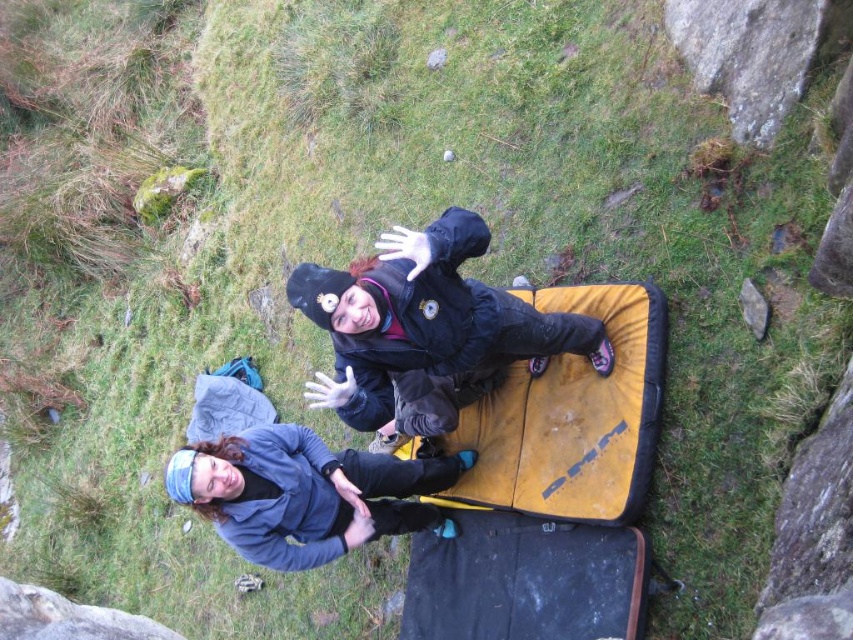
You are standing in the scene and want to move from the point at coordinates point [532,396] to the point at coordinates point [738,300]. Which direction should you face to walk towards the second point?

You should face away from the camera because point [738,300] is behind point [532,396].

You are planning to place a small picnic basket between the smooth gray rock at lower left and the smooth gray rock at center right. Considering their sizes, which rock should you place the basket closer to to ensure stability?

The smooth gray rock at lower left is much taller than the smooth gray rock at center right, so placing the picnic basket closer to the taller rock would provide better stability due to its larger base.

You are planning to place a small picnic basket on the ground in the image. The picnic basket needs to be placed on a stable surface. Given the blue fleece jacket at lower center and the smooth gray rock at lower left, which object should you choose to place the basket on?

The smooth gray rock at lower left is a better choice because the blue fleece jacket at lower center is positioned over it, meaning the jacket might not provide a stable surface, while the rock is solid and flat.